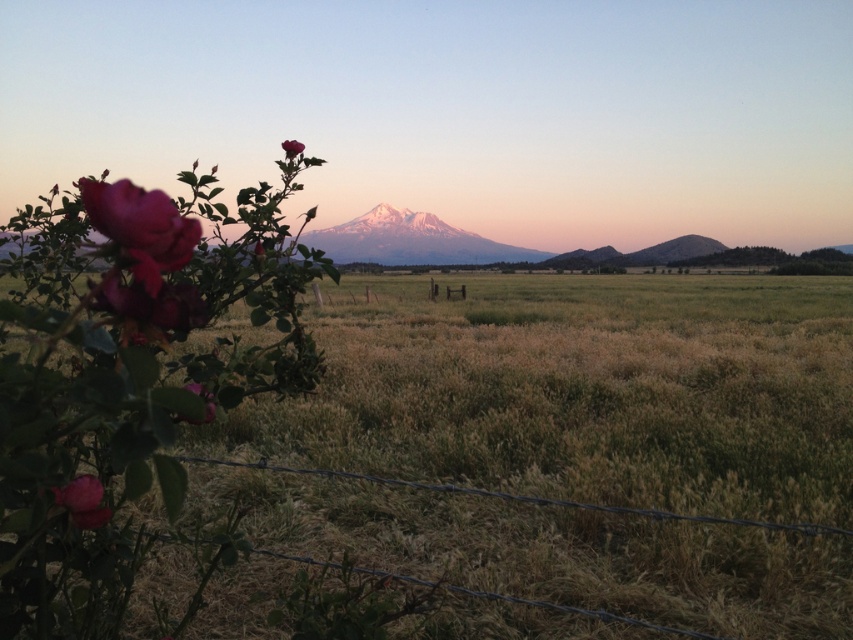
Question: Which point is closer to the camera?

Choices:
 (A) matte pink rose at lower left
 (B) wire/fabric at lower center

Answer: (A)

Question: Observing the image, what is the correct spatial positioning of snowy peak at center in reference to matte pink rose at upper center?

Choices:
 (A) above
 (B) below

Answer: (A)

Question: Which point appears farthest from the camera in this image?

Choices:
 (A) (193, 228)
 (B) (846, 621)
 (C) (801, 292)

Answer: (C)

Question: Can you confirm if wire/fabric at lower center is smaller than matte pink rose at upper center?

Choices:
 (A) no
 (B) yes

Answer: (A)

Question: Which of the following is the farthest from the observer?

Choices:
 (A) (492, 248)
 (B) (647, 397)
 (C) (393, 628)
 (D) (132, 252)

Answer: (A)

Question: In this image, where is grassy field at center located relative to wire/fabric at lower center?

Choices:
 (A) left
 (B) right

Answer: (B)